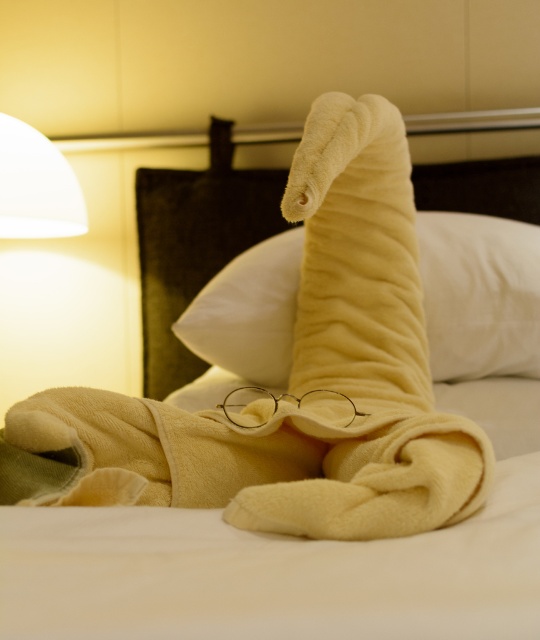
Is yellow plush pillow at center to the right of white matte lampshade at upper left from the viewer's perspective?

Yes, yellow plush pillow at center is to the right of white matte lampshade at upper left.

Who is positioned more to the right, yellow plush pillow at center or white matte lampshade at upper left?

yellow plush pillow at center is more to the right.

Is point (294, 257) positioned behind point (6, 128)?

No, it is in front of (6, 128).

Find the location of a particular element. Image resolution: width=540 pixels, height=640 pixels. yellow plush pillow at center is located at coordinates point(480,294).